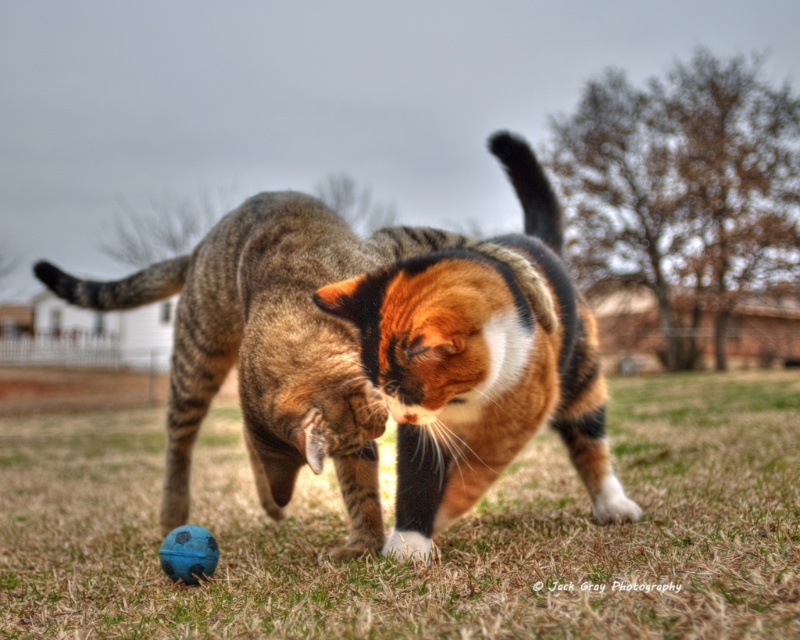
You are a photographer trying to capture a closeup of the calico cat and the tabby cat in the image. You have a camera with a focus range that can only clearly capture objects within 1 meter of the camera. If you position yourself so that the point at point (x=437, y=365) is exactly at the center of your focus, will the point at point (x=168, y=576) also be in focus?

The point at point (x=437, y=365) is closer to the viewer than point (x=168, y=576). Since the focus range is only 1 meter, and the distance between them isn not specified, it depends on their actual distance. However, based on the given information, we cannot determine if the second point is within the 1 meter focus range.

Based on the scene description, where is the green grass at center located in terms of its 2D coordinates?

The green grass at center is located at the 2D coordinates of point (434, 540).

You are a cat owner who wants to ensure your cats have enough space to play safely. Given the scene described, which object takes up more area in the image, the green grass at center or the blue rubber ball at lower left?

The green grass at center is bigger than the blue rubber ball at lower left, so the green grass at center takes up more area in the image.